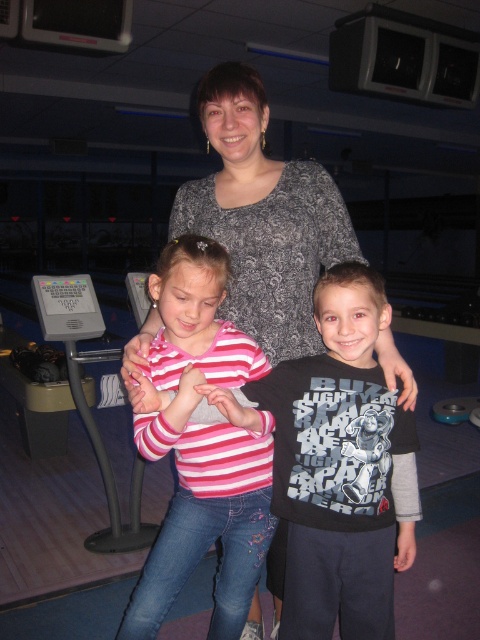
Is point (173, 291) less distant than point (247, 154)?

That is True.

From the picture: Who is higher up, pink striped shirt at center or dark gray textured sweater at center?

dark gray textured sweater at center

This screenshot has height=640, width=480. In order to click on pink striped shirt at center in this screenshot , I will do `click(202, 448)`.

Does black cotton shirt at center have a greater width compared to dark gray textured sweater at center?

Incorrect, black cotton shirt at center's width does not surpass dark gray textured sweater at center's.

The width and height of the screenshot is (480, 640). I want to click on black cotton shirt at center, so click(339, 467).

The height and width of the screenshot is (640, 480). What do you see at coordinates (339, 467) in the screenshot?
I see `black cotton shirt at center` at bounding box center [339, 467].

Identify the location of black cotton shirt at center. (339, 467).

Is black cotton shirt at center in front of pink striped shirt at center?

Yes.

Consider the image. Is black cotton shirt at center to the left of pink striped shirt at center from the viewer's perspective?

Incorrect, black cotton shirt at center is not on the left side of pink striped shirt at center.

Is point (382, 522) positioned after point (171, 525)?

No, it is not.

Where is `black cotton shirt at center`? The height and width of the screenshot is (640, 480). black cotton shirt at center is located at coordinates (339, 467).